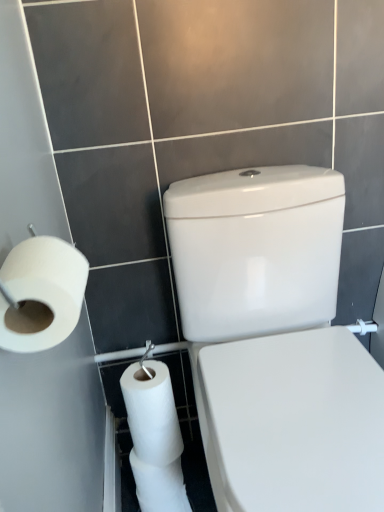
Question: From their relative heights in the image, would you say white matte toilet paper at left is taller or shorter than white glossy porcelain at center?

Choices:
 (A) tall
 (B) short

Answer: (B)

Question: From a real-world perspective, is white matte toilet paper at left positioned above or below white glossy porcelain at center?

Choices:
 (A) below
 (B) above

Answer: (B)

Question: In the image, is white matte toilet paper at left on the left side or the right side of white glossy porcelain at center?

Choices:
 (A) right
 (B) left

Answer: (B)

Question: Considering their positions, is white glossy porcelain at center located in front of or behind white matte toilet paper at left?

Choices:
 (A) behind
 (B) front

Answer: (B)

Question: Is white glossy porcelain at center wider or thinner than white matte toilet paper at left?

Choices:
 (A) thin
 (B) wide

Answer: (B)

Question: Is white glossy porcelain at center to the left or to the right of white matte toilet paper at left in the image?

Choices:
 (A) right
 (B) left

Answer: (A)

Question: From their relative heights in the image, would you say white glossy porcelain at center is taller or shorter than white matte toilet paper at left?

Choices:
 (A) tall
 (B) short

Answer: (A)